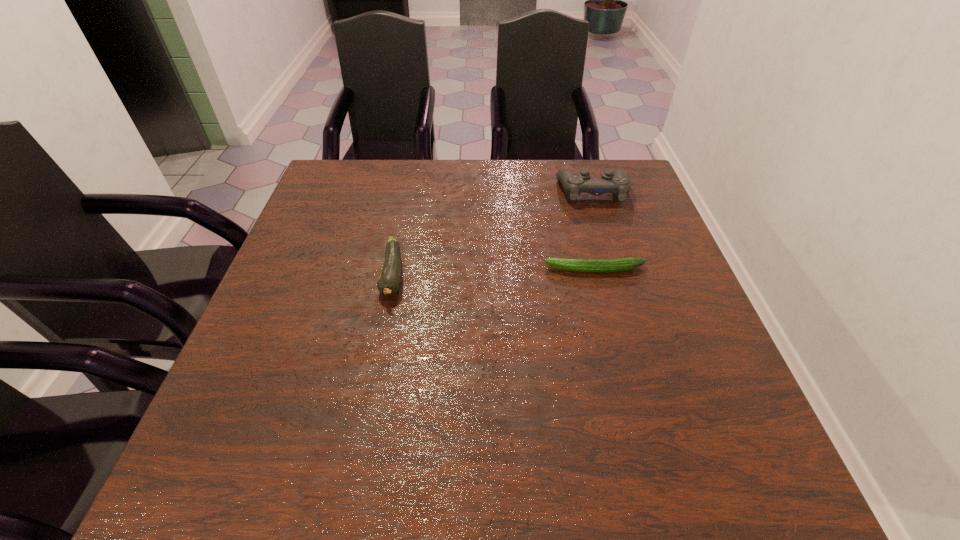
Where is `the farthest object`? The image size is (960, 540). the farthest object is located at coordinates (618, 183).

Locate an element on the screen. This screenshot has height=540, width=960. the tallest object is located at coordinates (618, 183).

You are a GUI agent. You are given a task and a screenshot of the screen. Output one action in this format:
    pyautogui.click(x=<x>, y=<y>)
    Task: Click on the left zucchini
    
    Given the screenshot: What is the action you would take?
    pyautogui.click(x=389, y=281)

Where is `the second shortest object`? This screenshot has width=960, height=540. the second shortest object is located at coordinates (389, 281).

I want to click on the shorter zucchini, so click(x=619, y=264).

The image size is (960, 540). I want to click on the shortest object, so click(x=619, y=264).

Locate an element on the screen. This screenshot has width=960, height=540. vacant space located 0.130m on the left of the farthest object is located at coordinates (512, 191).

I want to click on free space located 0.290m at the blossom end of the leftmost object, so pyautogui.click(x=362, y=435).

I want to click on blank space located 0.100m on the front-facing side of the shortest object, so click(x=502, y=269).

What are the coordinates of `vacant area situated 0.200m on the front-facing side of the shortest object` in the screenshot? It's located at (460, 269).